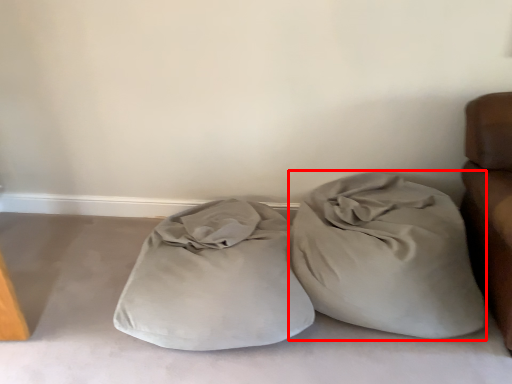
Question: Where is throw pillow (annotated by the red box) located in relation to pillow in the image?

Choices:
 (A) left
 (B) right

Answer: (B)